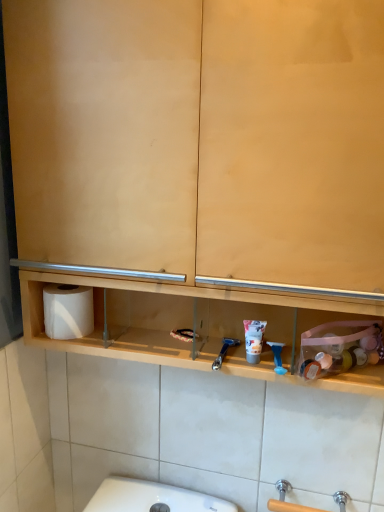
Measure the distance between point (46, 319) and camera.

Point (46, 319) is 37.83 inches from camera.

Identify the location of white matte toilet paper at left. (68, 311).

Find the location of a particular element. blue plastic razor at center, which is the 2th shower in right-to-left order is located at coordinates (224, 351).

What do you see at coordinates (224, 351) in the screenshot?
I see `blue plastic razor at center, the first shower viewed from the left` at bounding box center [224, 351].

What do you see at coordinates (254, 339) in the screenshot? I see `matte plastic shaving cream at center` at bounding box center [254, 339].

Find the location of a particular element. The width and height of the screenshot is (384, 512). white matte toilet paper at left is located at coordinates (68, 311).

Which object is more forward, blue plastic razor at center, arranged as the 2th shower when viewed from the left, or white matte toilet paper at left?

blue plastic razor at center, arranged as the 2th shower when viewed from the left, is in front.

Does blue plastic razor at center, marked as the first shower in a right-to-left arrangement, have a larger size compared to white matte toilet paper at left?

No, blue plastic razor at center, marked as the first shower in a right-to-left arrangement, is not bigger than white matte toilet paper at left.

Can you confirm if blue plastic razor at center, arranged as the 2th shower when viewed from the left, is positioned to the right of white matte toilet paper at left?

Yes, blue plastic razor at center, arranged as the 2th shower when viewed from the left, is to the right of white matte toilet paper at left.

Would you say blue plastic razor at center, marked as the first shower in a right-to-left arrangement, is inside or outside white matte toilet paper at left?

blue plastic razor at center, marked as the first shower in a right-to-left arrangement, is outside white matte toilet paper at left.

From a real-world perspective, who is located lower, blue plastic razor at center, marked as the first shower in a right-to-left arrangement, or blue plastic razor at center, the first shower viewed from the left?

From a 3D spatial view, blue plastic razor at center, the first shower viewed from the left, is below.

Between blue plastic razor at center, marked as the first shower in a right-to-left arrangement, and blue plastic razor at center, the first shower viewed from the left, which one has smaller width?

blue plastic razor at center, marked as the first shower in a right-to-left arrangement.

Is blue plastic razor at center, arranged as the 2th shower when viewed from the left, not within blue plastic razor at center, the first shower viewed from the left?

Absolutely, blue plastic razor at center, arranged as the 2th shower when viewed from the left, is external to blue plastic razor at center, the first shower viewed from the left.

Find the location of a particular element. This screenshot has width=384, height=512. shower on the left of matte plastic shaving cream at center is located at coordinates (224, 351).

Which object is closer to the camera, blue plastic razor at center, the first shower viewed from the left, or matte plastic shaving cream at center?

blue plastic razor at center, the first shower viewed from the left, is closer to the camera.

From a real-world perspective, is blue plastic razor at center, which is the 2th shower in right-to-left order, located higher than matte plastic shaving cream at center?

No, from a real-world perspective, blue plastic razor at center, which is the 2th shower in right-to-left order, is not on top of matte plastic shaving cream at center.

From their relative heights in the image, would you say blue plastic razor at center, the first shower viewed from the left, is taller or shorter than matte plastic shaving cream at center?

Clearly, blue plastic razor at center, the first shower viewed from the left, is shorter compared to matte plastic shaving cream at center.

Is white matte toilet paper at left to the left or to the right of blue plastic razor at center, the first shower viewed from the left, in the image?

Clearly, white matte toilet paper at left is on the left of blue plastic razor at center, the first shower viewed from the left, in the image.

From the image's perspective, would you say white matte toilet paper at left is shown under blue plastic razor at center, the first shower viewed from the left?

No, from the image's perspective, white matte toilet paper at left is not below blue plastic razor at center, the first shower viewed from the left.

From a real-world perspective, is white matte toilet paper at left positioned above or below blue plastic razor at center, which is the 2th shower in right-to-left order?

white matte toilet paper at left is situated higher than blue plastic razor at center, which is the 2th shower in right-to-left order, in the real world.

Considering the positions of objects white matte toilet paper at left and blue plastic razor at center, marked as the first shower in a right-to-left arrangement, in the image provided, who is more to the right, white matte toilet paper at left or blue plastic razor at center, marked as the first shower in a right-to-left arrangement,?

blue plastic razor at center, marked as the first shower in a right-to-left arrangement, is more to the right.

Is white matte toilet paper at left oriented towards blue plastic razor at center, marked as the first shower in a right-to-left arrangement?

No.

Considering the relative sizes of white matte toilet paper at left and blue plastic razor at center, arranged as the 2th shower when viewed from the left, in the image provided, is white matte toilet paper at left bigger than blue plastic razor at center, arranged as the 2th shower when viewed from the left,?

Yes.

Does blue plastic razor at center, which is the 2th shower in right-to-left order, appear on the left side of blue plastic razor at center, marked as the first shower in a right-to-left arrangement?

Indeed, blue plastic razor at center, which is the 2th shower in right-to-left order, is positioned on the left side of blue plastic razor at center, marked as the first shower in a right-to-left arrangement.

Can you tell me how much blue plastic razor at center, the first shower viewed from the left, and blue plastic razor at center, marked as the first shower in a right-to-left arrangement, differ in facing direction?

The angular difference between blue plastic razor at center, the first shower viewed from the left, and blue plastic razor at center, marked as the first shower in a right-to-left arrangement, is 11.4 degrees.

Is blue plastic razor at center, which is the 2th shower in right-to-left order, not inside blue plastic razor at center, marked as the first shower in a right-to-left arrangement?

Absolutely, blue plastic razor at center, which is the 2th shower in right-to-left order, is external to blue plastic razor at center, marked as the first shower in a right-to-left arrangement.

Considering the sizes of objects white matte toilet paper at left and matte plastic shaving cream at center in the image provided, who is taller, white matte toilet paper at left or matte plastic shaving cream at center?

With more height is white matte toilet paper at left.

From a real-world perspective, is white matte toilet paper at left positioned above or below matte plastic shaving cream at center?

From a real-world perspective, white matte toilet paper at left is physically above matte plastic shaving cream at center.

Relative to matte plastic shaving cream at center, is white matte toilet paper at left in front or behind?

In the image, white matte toilet paper at left appears behind matte plastic shaving cream at center.

Which of these two, white matte toilet paper at left or matte plastic shaving cream at center, is wider?

Wider between the two is white matte toilet paper at left.

This screenshot has height=512, width=384. What are the coordinates of `toilet paper above the blue plastic razor at center, arranged as the 2th shower when viewed from the left (from a real-world perspective)` in the screenshot? It's located at (68, 311).

Locate an element on the screen. This screenshot has width=384, height=512. shower in front of the blue plastic razor at center, which is the 2th shower in right-to-left order is located at coordinates (x=277, y=357).

Based on their spatial positions, is blue plastic razor at center, marked as the first shower in a right-to-left arrangement, or matte plastic shaving cream at center closer to blue plastic razor at center, which is the 2th shower in right-to-left order?

matte plastic shaving cream at center.

Considering their positions, is blue plastic razor at center, which is the 2th shower in right-to-left order, positioned further to blue plastic razor at center, marked as the first shower in a right-to-left arrangement, than matte plastic shaving cream at center?

Based on the image, blue plastic razor at center, which is the 2th shower in right-to-left order, appears to be further to blue plastic razor at center, marked as the first shower in a right-to-left arrangement.

Which object lies nearer to the anchor point blue plastic razor at center, the first shower viewed from the left, matte plastic shaving cream at center or white matte toilet paper at left?

matte plastic shaving cream at center.

Which object lies nearer to the anchor point matte plastic shaving cream at center, white matte toilet paper at left or blue plastic razor at center, the first shower viewed from the left?

blue plastic razor at center, the first shower viewed from the left.

Based on their spatial positions, is matte plastic shaving cream at center or blue plastic razor at center, marked as the first shower in a right-to-left arrangement, closer to white matte toilet paper at left?

matte plastic shaving cream at center.

Which object lies further to the anchor point blue plastic razor at center, arranged as the 2th shower when viewed from the left, white matte toilet paper at left or blue plastic razor at center, which is the 2th shower in right-to-left order?

Based on the image, white matte toilet paper at left appears to be further to blue plastic razor at center, arranged as the 2th shower when viewed from the left.

Looking at the image, which one is located closer to white matte toilet paper at left, blue plastic razor at center, marked as the first shower in a right-to-left arrangement, or matte plastic shaving cream at center?

Based on the image, matte plastic shaving cream at center appears to be nearer to white matte toilet paper at left.

From the image, which object appears to be nearer to white matte toilet paper at left, blue plastic razor at center, the first shower viewed from the left, or blue plastic razor at center, arranged as the 2th shower when viewed from the left?

blue plastic razor at center, the first shower viewed from the left, is positioned closer to the anchor white matte toilet paper at left.

Locate an element on the screen. Image resolution: width=384 pixels, height=512 pixels. shower between white matte toilet paper at left and blue plastic razor at center, arranged as the 2th shower when viewed from the left, from left to right is located at coordinates (224, 351).

I want to click on shaving cream located between blue plastic razor at center, which is the 2th shower in right-to-left order, and blue plastic razor at center, arranged as the 2th shower when viewed from the left, in the left-right direction, so click(254, 339).

Locate an element on the screen. This screenshot has width=384, height=512. shaving cream located between white matte toilet paper at left and blue plastic razor at center, arranged as the 2th shower when viewed from the left, in the left-right direction is located at coordinates (254, 339).

In order to click on shower situated between white matte toilet paper at left and matte plastic shaving cream at center from left to right in this screenshot , I will do `click(224, 351)`.